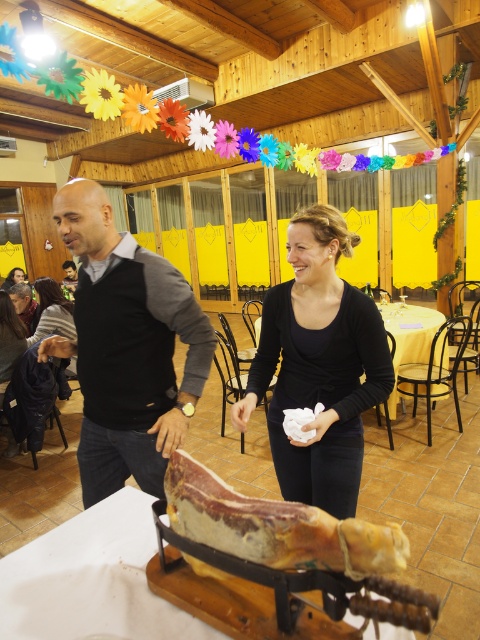
Question: Does black matte dress at center have a greater width compared to raw cured meat at center?

Choices:
 (A) no
 (B) yes

Answer: (B)

Question: Can you confirm if black matte dress at center is bigger than wooden carved leg of ham at center?

Choices:
 (A) no
 (B) yes

Answer: (B)

Question: Which point is closer to the camera?

Choices:
 (A) matte black sweater at center
 (B) dark gray sweater at left
 (C) raw cured meat at center
 (D) black matte dress at center

Answer: (C)

Question: Which point is closer to the camera?

Choices:
 (A) dark brown hair at lower left
 (B) dark brown leather jacket at lower left
 (C) wooden carved leg of ham at center
 (D) raw cured meat at center

Answer: (D)

Question: Where is raw cured meat at center located in relation to matte black sweater at center in the image?

Choices:
 (A) above
 (B) below

Answer: (B)

Question: Which point is farther from the camera taking this photo?

Choices:
 (A) (49, 285)
 (B) (143, 556)

Answer: (A)